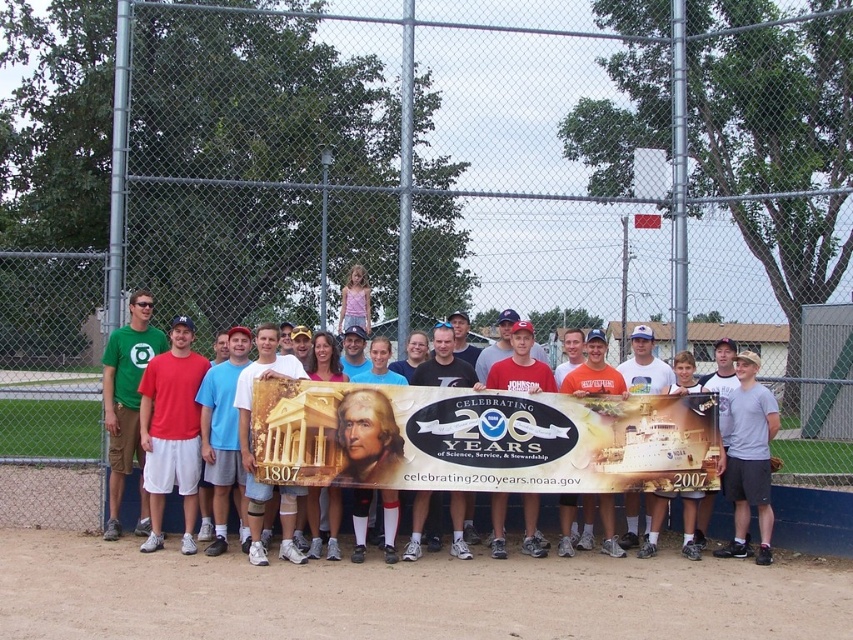
Measure the distance between matte white banner at center and green matte t-shirt at center.

A distance of 6.37 feet exists between matte white banner at center and green matte t-shirt at center.

Is the position of matte white banner at center more distant than that of green matte t-shirt at center?

That is False.

Which is behind, point (500, 378) or point (125, 476)?

The point (125, 476) is behind.

Locate an element on the screen. The height and width of the screenshot is (640, 853). matte white banner at center is located at coordinates (471, 435).

Is point (570, 460) in front of point (407, 554)?

No, it is behind (407, 554).

Does matte white banner at center come in front of matte black t-shirt at center?

Yes, it is in front of matte black t-shirt at center.

Which is behind, point (292, 448) or point (451, 380)?

Point (451, 380)

Identify the location of matte white banner at center. (471, 435).

You are a GUI agent. You are given a task and a screenshot of the screen. Output one action in this format:
    pyautogui.click(x=<x>, y=<y>)
    Task: Click on the matte black t-shirt at center
    
    Given the screenshot: What is the action you would take?
    pyautogui.click(x=444, y=362)

Does point (413, 547) come closer to viewer compared to point (650, 380)?

Yes, point (413, 547) is in front of point (650, 380).

At what (x,y) coordinates should I click in order to perform the action: click on matte black t-shirt at center. Please return your answer as a coordinate pair (x, y). This screenshot has height=640, width=853. Looking at the image, I should click on (444, 362).